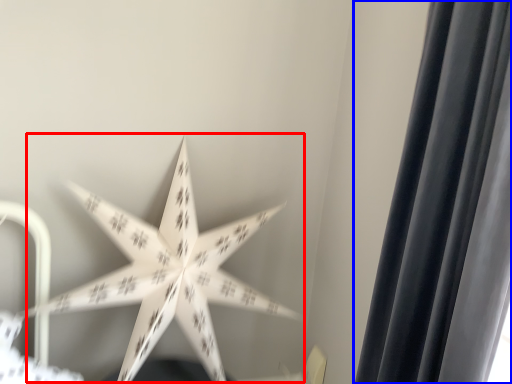
Question: Among these objects, which one is farthest to the camera, star (highlighted by a red box) or curtain (highlighted by a blue box)?

Choices:
 (A) star
 (B) curtain

Answer: (A)